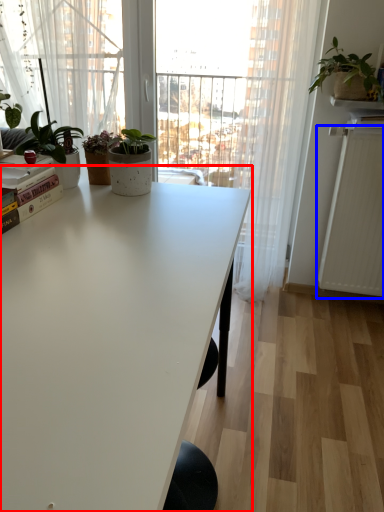
Question: Which of the following is the closest to the observer, table (highlighted by a red box) or radiator (highlighted by a blue box)?

Choices:
 (A) table
 (B) radiator

Answer: (A)